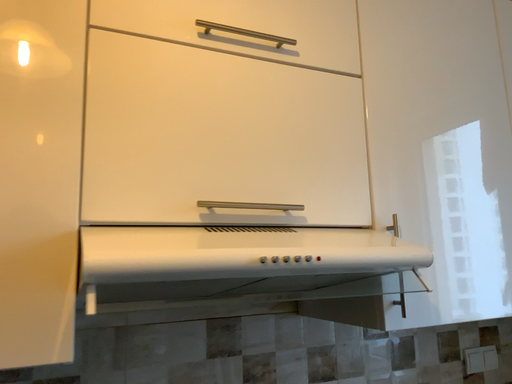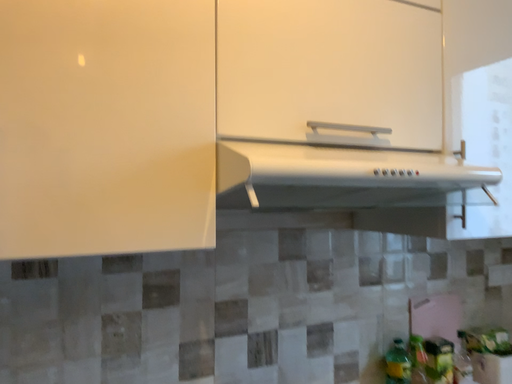
Question: How did the camera likely rotate when shooting the video?

Choices:
 (A) rotated upward
 (B) rotated downward

Answer: (B)